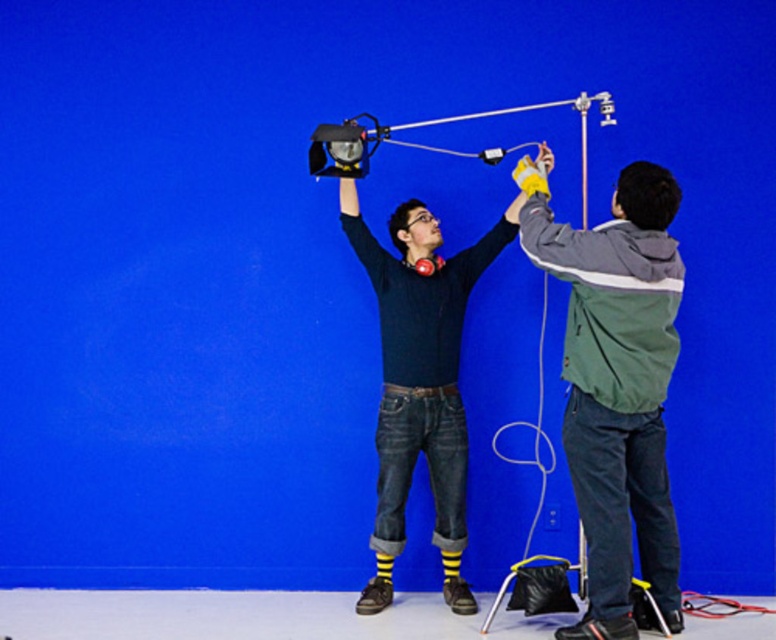
Question: Which of the following is the farthest from the observer?

Choices:
 (A) green fabric jacket at right
 (B) dark blue sweater at center

Answer: (B)

Question: Does green fabric jacket at right appear over dark blue sweater at center?

Choices:
 (A) yes
 (B) no

Answer: (B)

Question: Is green fabric jacket at right closer to camera compared to dark blue sweater at center?

Choices:
 (A) no
 (B) yes

Answer: (B)

Question: Among these objects, which one is farthest from the camera?

Choices:
 (A) dark blue sweater at center
 (B) green fabric jacket at right

Answer: (A)

Question: Is green fabric jacket at right above dark blue sweater at center?

Choices:
 (A) yes
 (B) no

Answer: (B)